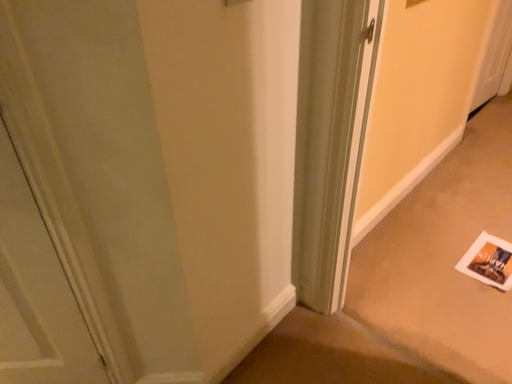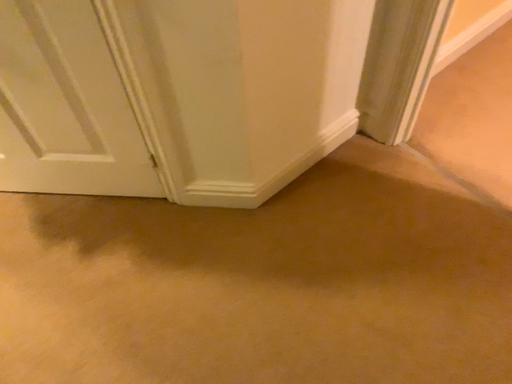
Question: Which way did the camera rotate in the video?

Choices:
 (A) rotated upward
 (B) rotated downward

Answer: (B)